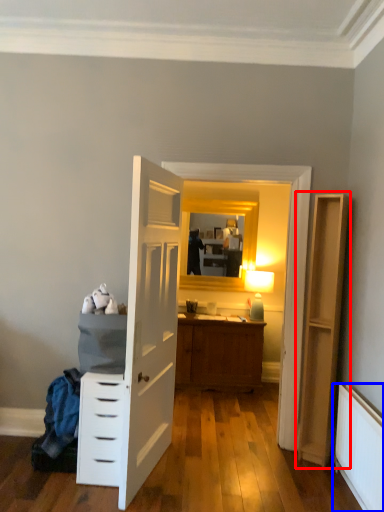
Question: Which of the following is the closest to the observer, file cabinet (highlighted by a red box) or radiator (highlighted by a blue box)?

Choices:
 (A) file cabinet
 (B) radiator

Answer: (B)